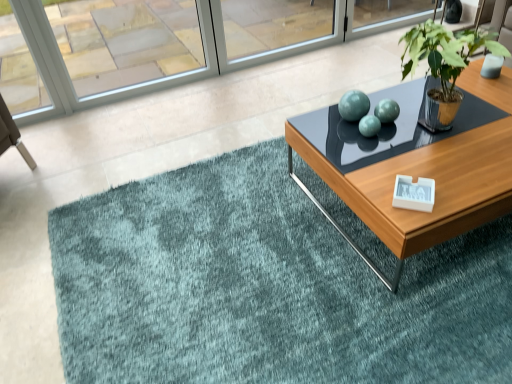
Find the location of `vacant space situated above teal plush rug at center (from a real-world perspective)`. vacant space situated above teal plush rug at center (from a real-world perspective) is located at coordinates (286, 267).